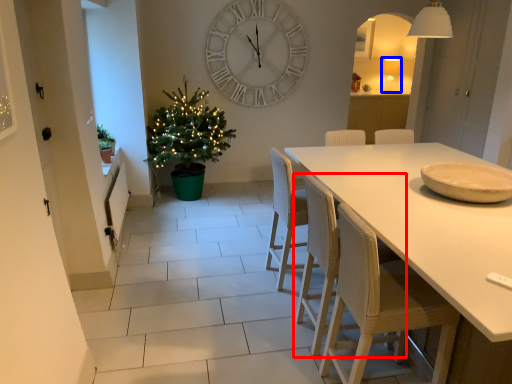
Question: Which object appears closest to the camera in this image, chair (highlighted by a red box) or lamp (highlighted by a blue box)?

Choices:
 (A) chair
 (B) lamp

Answer: (A)